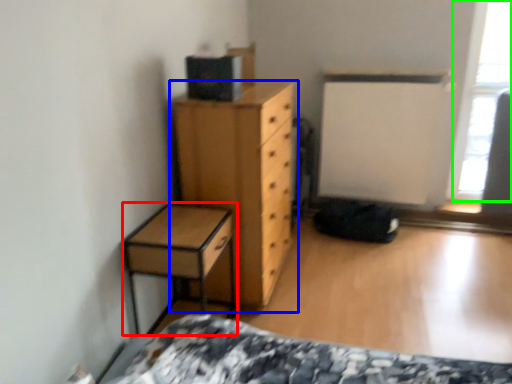
Question: Considering the real-world distances, which object is closest to nightstand (highlighted by a red box)? chest of drawers (highlighted by a blue box) or window screen (highlighted by a green box).

Choices:
 (A) chest of drawers
 (B) window screen

Answer: (A)